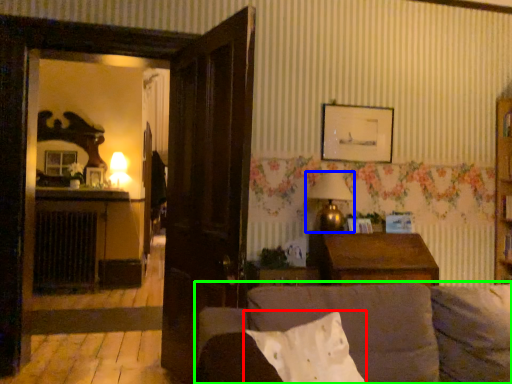
Question: Considering the real-world distances, which object is farthest from pillow (highlighted by a red box)? lamp (highlighted by a blue box) or studio couch (highlighted by a green box)?

Choices:
 (A) lamp
 (B) studio couch

Answer: (A)